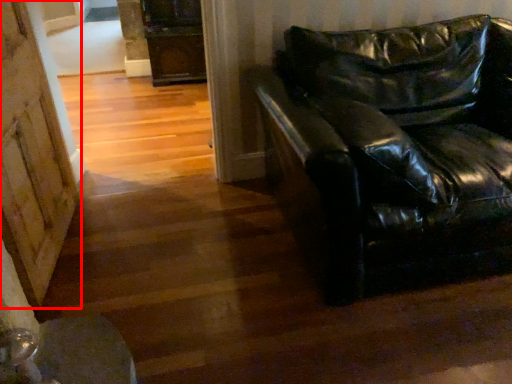
Question: From the image's perspective, considering the relative positions of barn door (annotated by the red box) and studio couch in the image provided, where is barn door (annotated by the red box) located with respect to the staircase?

Choices:
 (A) above
 (B) below

Answer: (B)